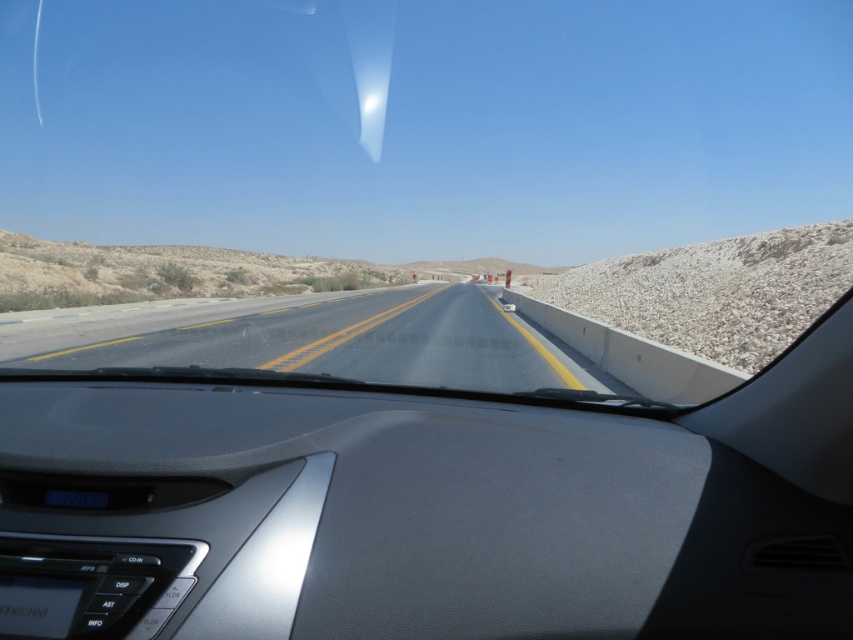
Does smooth asphalt highway at center appear over white gravel at right?

No, smooth asphalt highway at center is not above white gravel at right.

Can you confirm if smooth asphalt highway at center is positioned to the right of white gravel at right?

Incorrect, smooth asphalt highway at center is not on the right side of white gravel at right.

Between point (564, 378) and point (699, 289), which one is positioned in front?

Point (564, 378)

Locate an element on the screen. Image resolution: width=853 pixels, height=640 pixels. smooth asphalt highway at center is located at coordinates (337, 340).